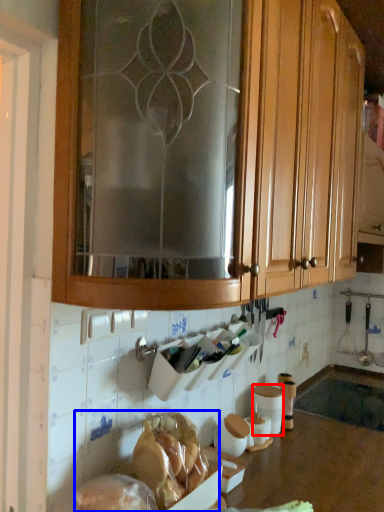
Question: Which object is further to the camera taking this photo, pottery (highlighted by a red box) or food (highlighted by a blue box)?

Choices:
 (A) pottery
 (B) food

Answer: (A)